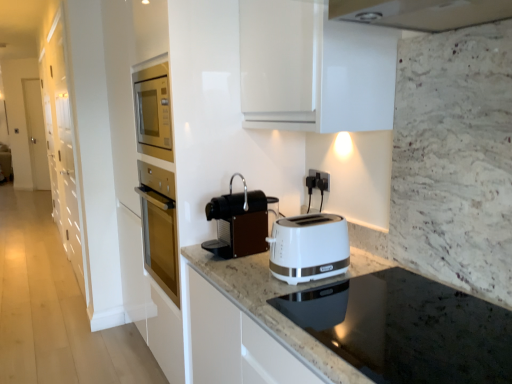
Question: Is white glossy cabinet at left outside of black plastic electrical outlet at center?

Choices:
 (A) yes
 (B) no

Answer: (A)

Question: Is white glossy cabinet at left next to black plastic electrical outlet at center and touching it?

Choices:
 (A) no
 (B) yes

Answer: (A)

Question: From the image's perspective, is white glossy cabinet at left under black plastic electrical outlet at center?

Choices:
 (A) no
 (B) yes

Answer: (A)

Question: Considering the relative sizes of white glossy cabinet at left and black plastic electrical outlet at center in the image provided, is white glossy cabinet at left shorter than black plastic electrical outlet at center?

Choices:
 (A) no
 (B) yes

Answer: (A)

Question: Does white glossy cabinet at left have a greater width compared to black plastic electrical outlet at center?

Choices:
 (A) yes
 (B) no

Answer: (A)

Question: Is white glossy cabinet at left aimed at black plastic electrical outlet at center?

Choices:
 (A) yes
 (B) no

Answer: (B)

Question: Can you confirm if black granite countertop at lower center is smaller than brown matte coffee machine at center?

Choices:
 (A) yes
 (B) no

Answer: (B)

Question: From a real-world perspective, is black granite countertop at lower center physically above brown matte coffee machine at center?

Choices:
 (A) yes
 (B) no

Answer: (B)

Question: Is black granite countertop at lower center taller than brown matte coffee machine at center?

Choices:
 (A) no
 (B) yes

Answer: (A)

Question: Considering the relative positions of black granite countertop at lower center and brown matte coffee machine at center in the image provided, is black granite countertop at lower center to the left of brown matte coffee machine at center from the viewer's perspective?

Choices:
 (A) yes
 (B) no

Answer: (B)

Question: Does black granite countertop at lower center touch brown matte coffee machine at center?

Choices:
 (A) yes
 (B) no

Answer: (B)

Question: Does black granite countertop at lower center have a greater width compared to brown matte coffee machine at center?

Choices:
 (A) no
 (B) yes

Answer: (B)

Question: Would you say black plastic electrical outlet at center is outside black granite countertop at lower center?

Choices:
 (A) yes
 (B) no

Answer: (A)